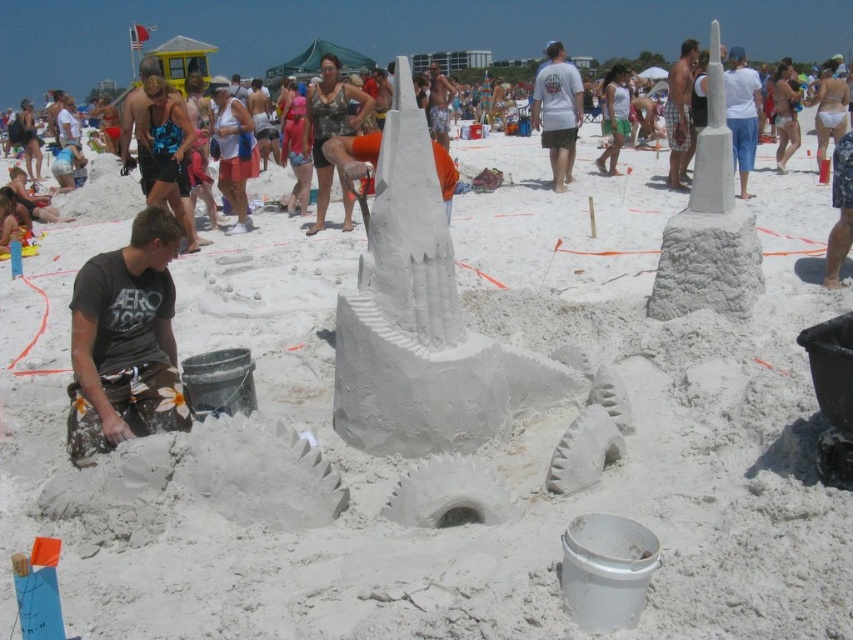
Consider the image. Which of these two, white cotton t-shirt at upper center or white cotton tank top at center, stands taller?

Standing taller between the two is white cotton t-shirt at upper center.

Between white cotton t-shirt at upper center and white cotton tank top at center, which one appears on the left side from the viewer's perspective?

white cotton t-shirt at upper center

At what (x,y) coordinates should I click in order to perform the action: click on white cotton t-shirt at upper center. Please return your answer as a coordinate pair (x, y). Looking at the image, I should click on (556, 109).

Which of these two, plaid shorts at center or white cotton tank top at center, stands shorter?

white cotton tank top at center is shorter.

Who is higher up, plaid shorts at center or white cotton tank top at center?

plaid shorts at center is above.

The image size is (853, 640). I want to click on plaid shorts at center, so click(x=680, y=113).

Who is higher up, white cotton t-shirt at upper center or plaid shorts at center?

plaid shorts at center is above.

You are a GUI agent. You are given a task and a screenshot of the screen. Output one action in this format:
    pyautogui.click(x=<x>, y=<y>)
    Task: Click on the white cotton t-shirt at upper center
    The width and height of the screenshot is (853, 640).
    Given the screenshot: What is the action you would take?
    pyautogui.click(x=556, y=109)